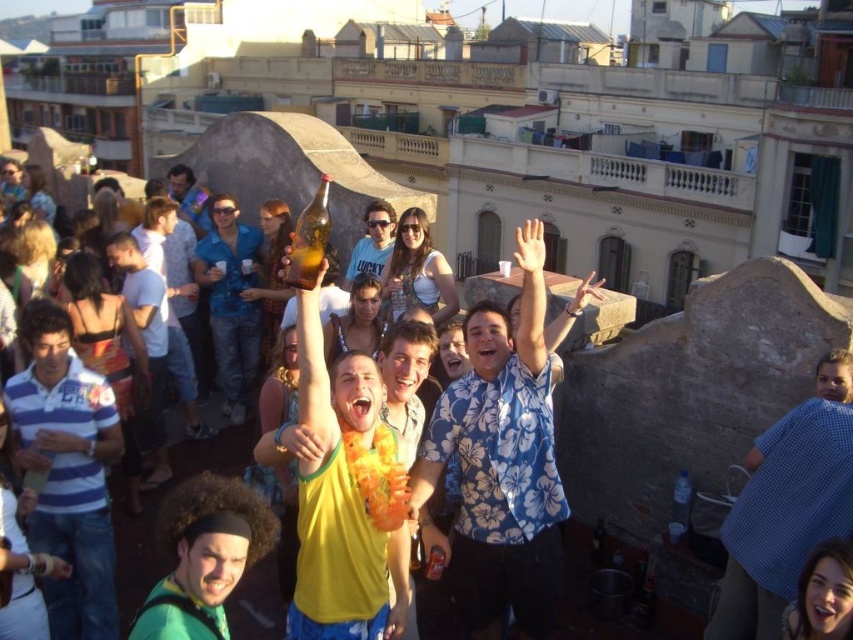
You are standing at the rooftop party and want to take a photo of both the point at position (784,481) and the point at position (827,604). Which point will appear closer to the camera in the photo?

Point (784,481) is further to the viewer than point (827,604). Therefore, in the photo, point (827,604) will appear closer to the camera because it is physically closer to the viewer.

You are standing in the rooftop party scene. There is a point marked at coordinates point (721, 586). If you want to throw a frisbee to that point, will it land within the rooftop area?

The point (721, 586) is 22.68 meters away from the viewer. Since rooftops are typically limited in size, throwing a frisbee that far might send it beyond the rooftop area into the adjacent buildings or open space. However, without knowing the exact dimensions of the rooftop, it is uncertain. But based on typical rooftop party setups, it is likely the frisbee would land outside the rooftop area.

You are a photographer trying to capture a candid shot of the blue checkered shirt at lower right and the smooth skin face at center. Since you want to ensure both subjects are in focus, you need to know which one is narrower. Which object is narrower?

The blue checkered shirt at lower right is narrower than the smooth skin face at center.